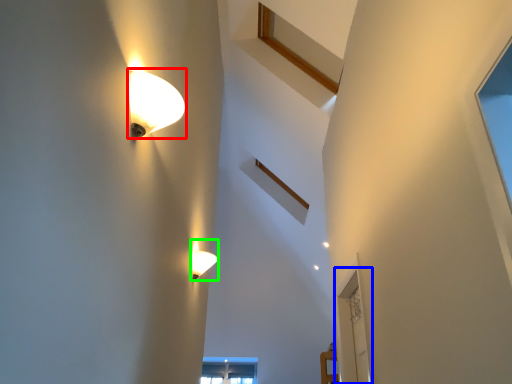
Question: Based on their relative distances, which object is nearer to lamp (highlighted by a red box)? Choose from glass door (highlighted by a blue box) and lamp (highlighted by a green box).

Choices:
 (A) glass door
 (B) lamp

Answer: (B)